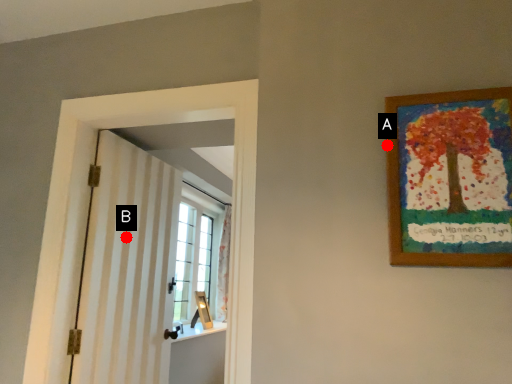
Question: Two points are circled on the image, labeled by A and B beside each circle. Which point is closer to the camera?

Choices:
 (A) A is closer
 (B) B is closer

Answer: (A)